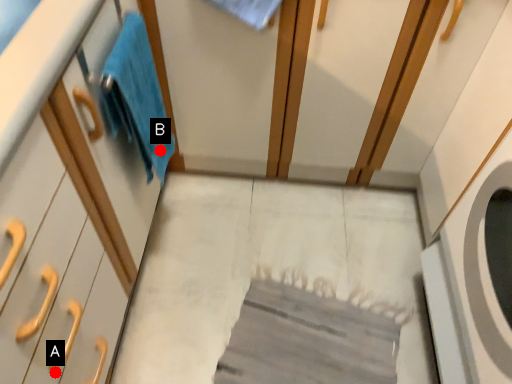
Question: Two points are circled on the image, labeled by A and B beside each circle. Which point is closer to the camera?

Choices:
 (A) A is closer
 (B) B is closer

Answer: (A)